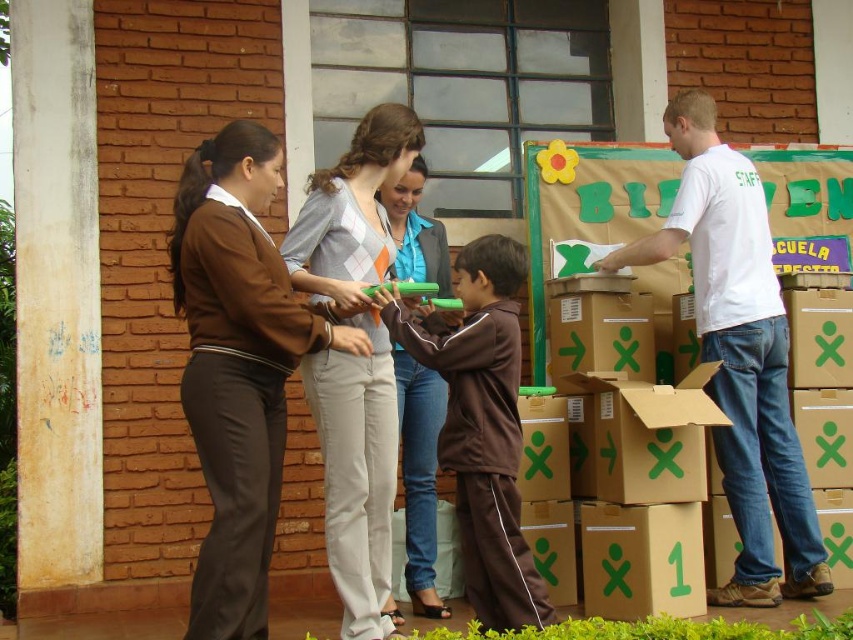
Between point (759, 426) and point (317, 292), which one is positioned behind?

Point (759, 426)

Measure the distance from white cotton t-shirt at right to light gray cotton pants at center.

white cotton t-shirt at right and light gray cotton pants at center are 3.10 meters apart.

Is point (708, 381) in front of point (389, 408)?

No, it is behind (389, 408).

The image size is (853, 640). Find the location of `white cotton t-shirt at right`. white cotton t-shirt at right is located at coordinates (740, 355).

Which of these two, light gray cotton pants at center or brown matte/suede tracksuit at center, stands taller?

With more height is light gray cotton pants at center.

Who is more distant from viewer, (305,224) or (471,522)?

Positioned behind is point (471,522).

This screenshot has width=853, height=640. Identify the location of light gray cotton pants at center. (355, 358).

Is white cotton t-shirt at right smaller than light gray wool sweater at center?

No, white cotton t-shirt at right is not smaller than light gray wool sweater at center.

Where is `white cotton t-shirt at right`? This screenshot has height=640, width=853. white cotton t-shirt at right is located at coordinates (740, 355).

Which is in front, point (708, 148) or point (389, 209)?

Point (708, 148) is in front.

The image size is (853, 640). Identify the location of white cotton t-shirt at right. (740, 355).